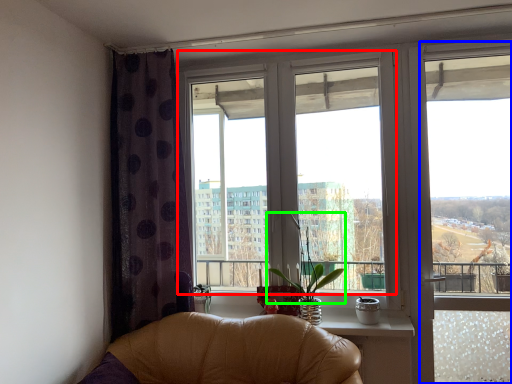
Question: Which object is positioned farthest from window (highlighted by a red box)? Select from window frame (highlighted by a blue box) and plant (highlighted by a green box).

Choices:
 (A) window frame
 (B) plant

Answer: (A)